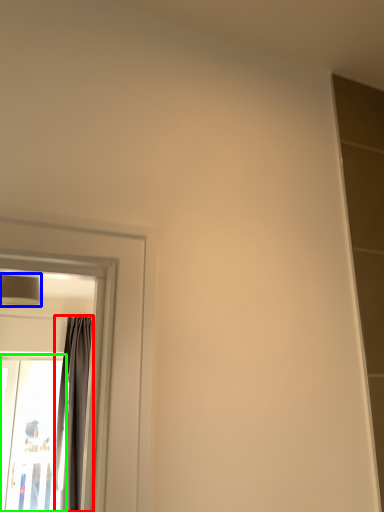
Question: Which object is positioned farthest from curtain (highlighted by a red box)? Select from lamp (highlighted by a blue box) and screen door (highlighted by a green box).

Choices:
 (A) lamp
 (B) screen door

Answer: (A)